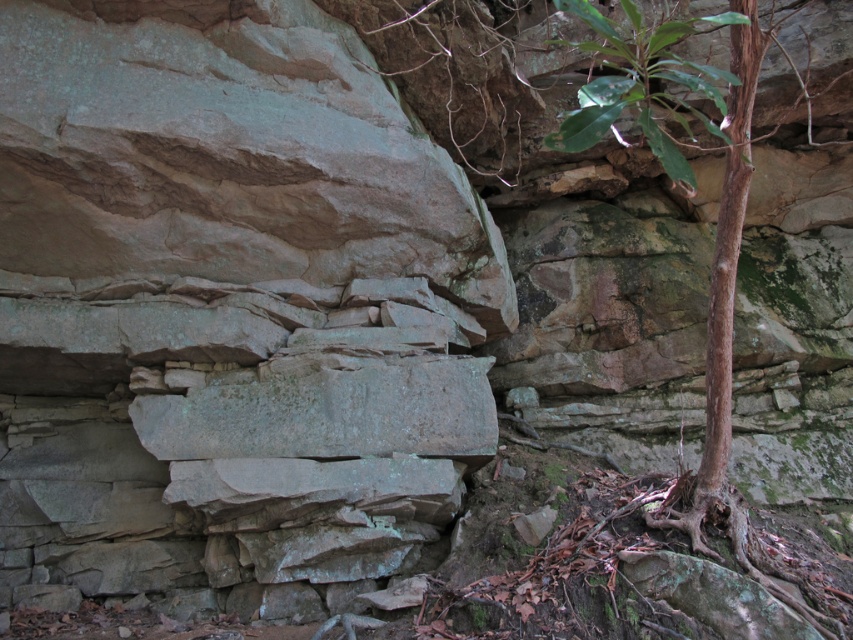
Who is higher up, gray stone wall at center or green leafy plant at upper right?

green leafy plant at upper right

Does gray stone wall at center appear on the right side of green leafy plant at upper right?

No, gray stone wall at center is not to the right of green leafy plant at upper right.

Is point (90, 96) less distant than point (675, 29)?

No, it is behind (675, 29).

Where is `gray stone wall at center`? gray stone wall at center is located at coordinates (229, 301).